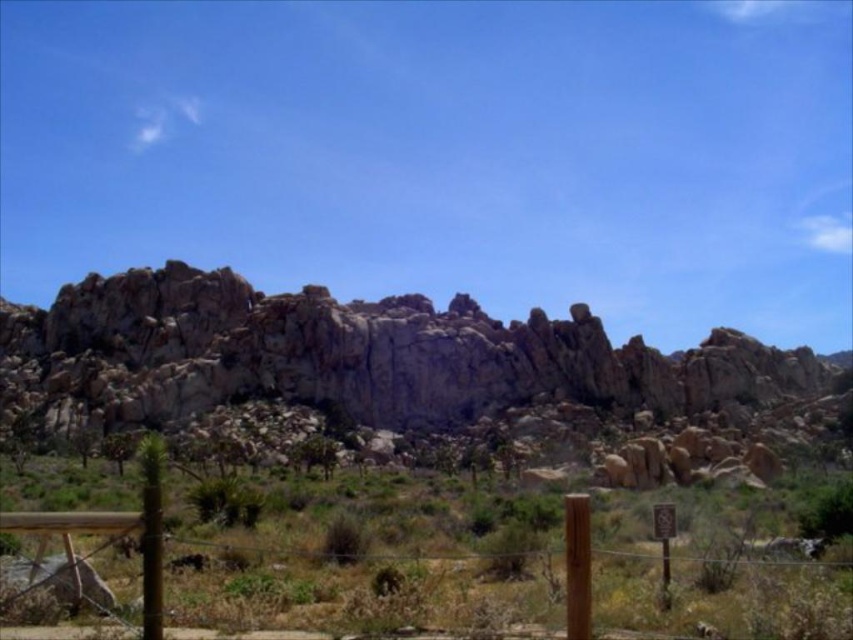
You are a hiker trying to navigate through the desert. You see the brown wooden fence at lower center and the rocky gray mountain at center. Which object is closer to you based on their positions?

The brown wooden fence at lower center is behind the rocky gray mountain at center, so the rocky gray mountain at center is closer to you.

You are standing at the point marked by the coordinates point (357, 355) in the desert scene. What is the most prominent feature directly in front of you?

The point (357, 355) indicates rocky gray mountain at center, so the most prominent feature directly in front of you is the rocky gray mountain at center.

You are a hiker trying to navigate through the desert. You see the rocky gray mountain at center and the brown wooden fence at lower center. Which object is located to the right of the other?

The rocky gray mountain at center is positioned on the right side of brown wooden fence at lower center, so the mountain is to the right of the fence.